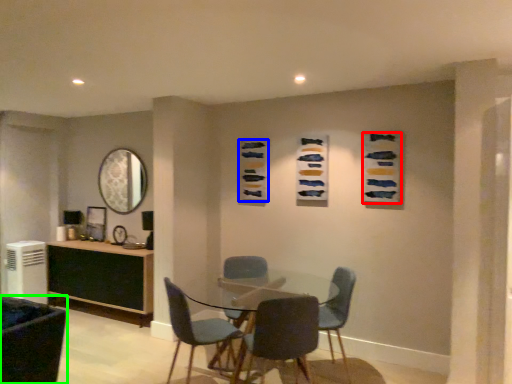
Question: Based on their relative distances, which object is farther from art (highlighted by a red box)? Choose from art (highlighted by a blue box) and chair (highlighted by a green box).

Choices:
 (A) art
 (B) chair

Answer: (B)